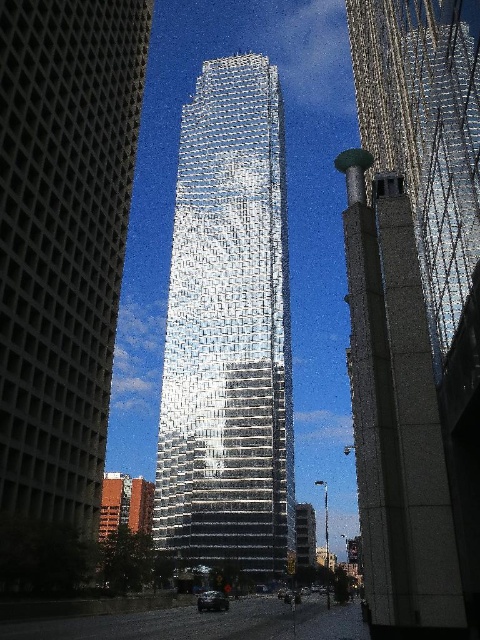
Question: Which object appears closest to the camera in this image?

Choices:
 (A) reflective glass tower at center
 (B) reflective glass skyscraper at right
 (C) silver reflective glass tower at center

Answer: (B)

Question: Which object is farther from the camera taking this photo?

Choices:
 (A) reflective glass tower at center
 (B) silver reflective glass tower at center
 (C) gray concrete tower at center
 (D) reflective glass skyscraper at right

Answer: (A)

Question: Based on their relative distances, which object is farther from the reflective glass tower at center?

Choices:
 (A) silver reflective glass tower at center
 (B) reflective glass skyscraper at right

Answer: (B)

Question: Is silver reflective glass tower at center positioned in front of reflective glass tower at center?

Choices:
 (A) no
 (B) yes

Answer: (B)

Question: Is gray concrete tower at center thinner than reflective glass skyscraper at right?

Choices:
 (A) no
 (B) yes

Answer: (A)

Question: Does reflective glass tower at center have a greater width compared to reflective glass skyscraper at right?

Choices:
 (A) no
 (B) yes

Answer: (B)